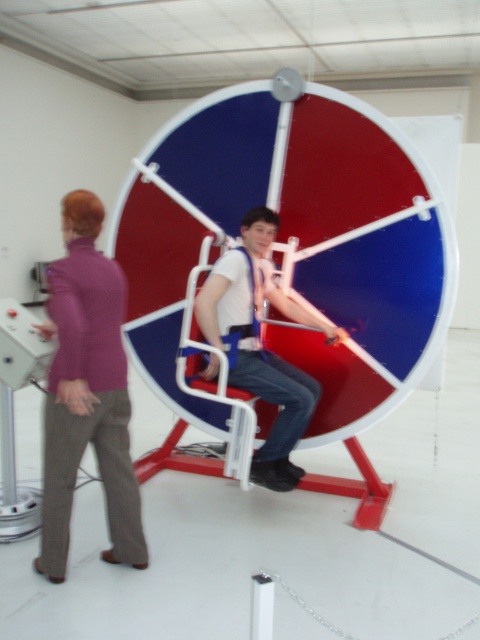
You are a physical therapist observing the scene. You need to adjust the harness for the patient. Which object, the matte purple shirt at left or the white fabric harness at center, is more suitable to use for padding if you need a thinner material?

The matte purple shirt at left is thinner than the white fabric harness at center, so it would be more suitable for padding if a thinner material is needed.